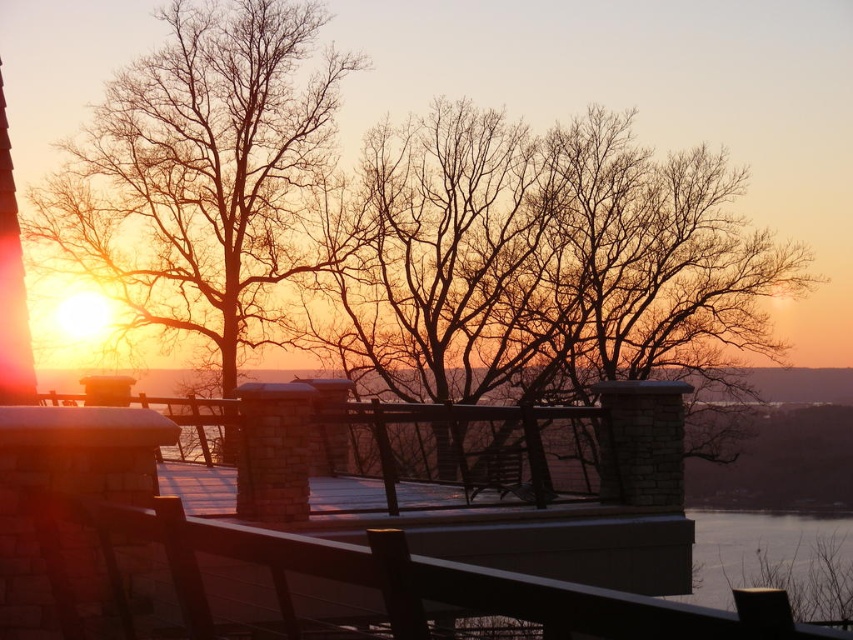
Can you confirm if bare branches at left is shorter than transparent glass water at lower right?

No.

Image resolution: width=853 pixels, height=640 pixels. What do you see at coordinates (207, 176) in the screenshot? I see `bare branches at left` at bounding box center [207, 176].

Where is `bare branches at left`? This screenshot has width=853, height=640. bare branches at left is located at coordinates (207, 176).

Can you confirm if brown wood balcony at center is wider than bare branches at left?

No, brown wood balcony at center is not wider than bare branches at left.

Does brown wood balcony at center appear on the right side of bare branches at left?

Correct, you'll find brown wood balcony at center to the right of bare branches at left.

Measure the distance between brown wood balcony at center and camera.

brown wood balcony at center is 5.58 feet from camera.

In order to click on brown wood balcony at center in this screenshot , I will do point(335,536).

Is brown wood balcony at center below transparent glass water at lower right?

No.

Does brown wood balcony at center have a lesser height compared to transparent glass water at lower right?

Correct, brown wood balcony at center is not as tall as transparent glass water at lower right.

Which is behind, point (35, 484) or point (701, 596)?

The point (701, 596) is behind.

The width and height of the screenshot is (853, 640). In order to click on brown wood balcony at center in this screenshot , I will do `click(335, 536)`.